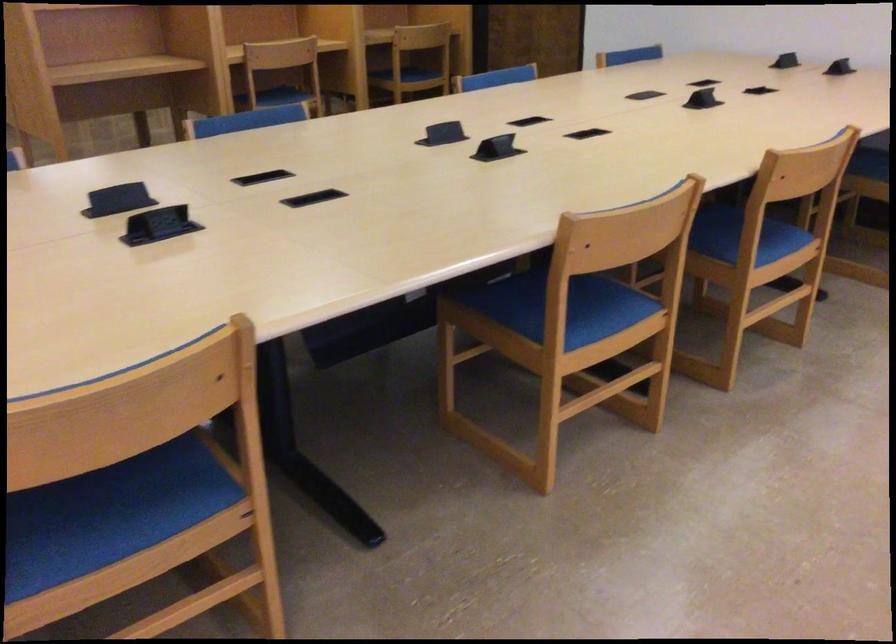
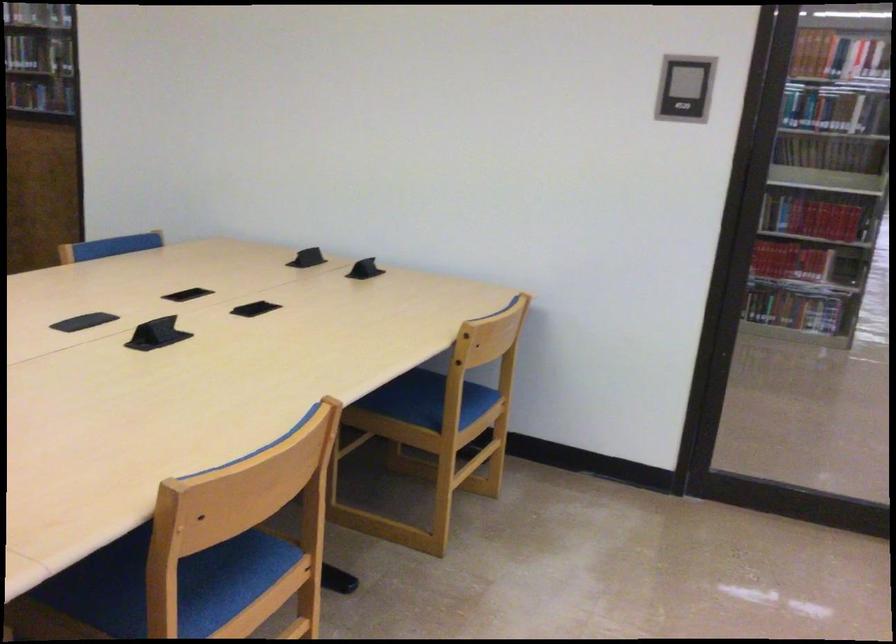
In the second image, find the point that corresponds to (755,212) in the first image.

(174, 585)